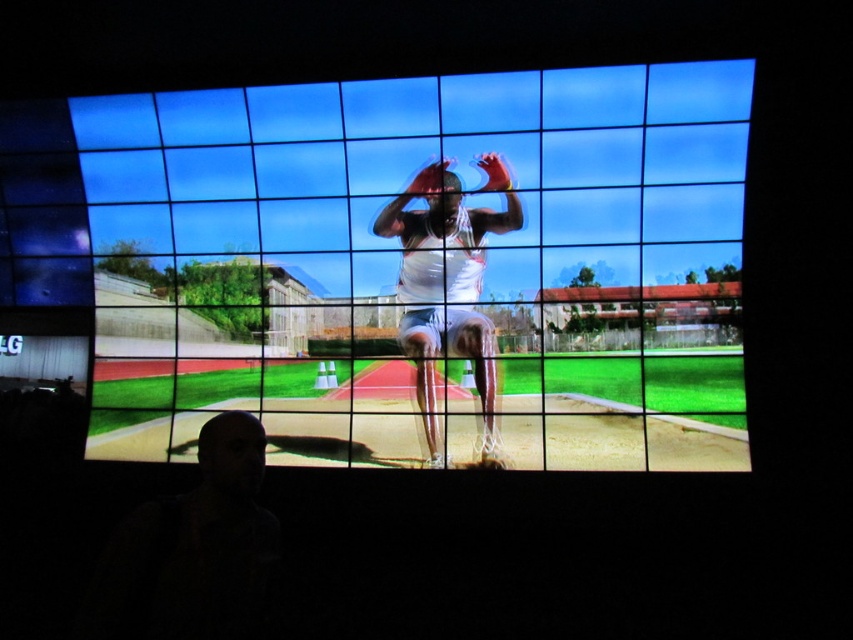
Consider the image. You are an athlete preparing to jump onto the track. Based on the image, can you safely land on the smooth white track at center without slipping, considering the position of the white matte athletic uniform at center?

The smooth white track at center is positioned over the white matte athletic uniform at center, so landing on the track would be safe as it is above the uniform and likely provides a stable surface for landing.

You are standing in front of the large screen showing the track and field competition. You notice two points marked on the screen at coordinates point (218,93) and point (490,170). If you were to draw a straight line between these two points on the screen, which point would you reach first as you move from the top of the screen towards the bottom?

The point at (218,93) is further to the camera than point (490,170). Therefore, when moving from the top of the screen towards the bottom, you would reach point (490,170) first because it is closer to the viewer.

You are an athlete preparing to jump from the smooth white track at center to the white matte athletic uniform at center. Can you safely make the jump if your maximum jump distance is 4.5 feet?

The smooth white track at center and white matte athletic uniform at center are 4.69 feet apart from each other. Since your maximum jump distance is 4.5 feet, you cannot safely make the jump as the distance required is greater than your capability.